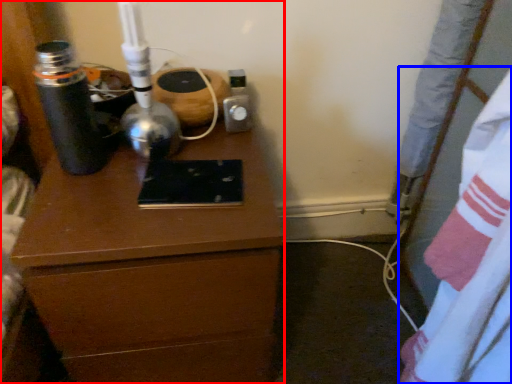
Question: Which point is further to the camera, chest of drawers (highlighted by a red box) or sheet (highlighted by a blue box)?

Choices:
 (A) chest of drawers
 (B) sheet

Answer: (A)